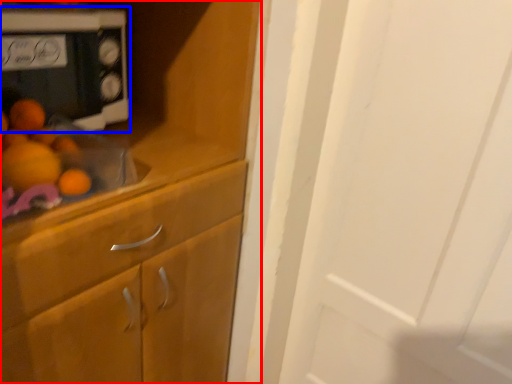
Question: Which object is further to the camera taking this photo, cabinetry (highlighted by a red box) or home appliance (highlighted by a blue box)?

Choices:
 (A) cabinetry
 (B) home appliance

Answer: (B)